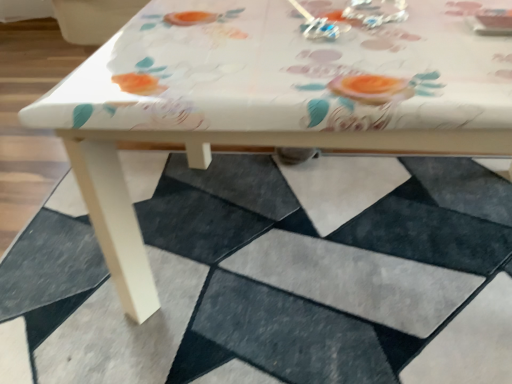
Measure the distance between metallic silver earrings at upper center and camera.

metallic silver earrings at upper center and camera are 66.27 centimeters apart from each other.

Where is `metallic silver earrings at upper center`? metallic silver earrings at upper center is located at coordinates (316, 25).

This screenshot has height=384, width=512. What do you see at coordinates (316, 25) in the screenshot? I see `metallic silver earrings at upper center` at bounding box center [316, 25].

In order to face white matte rug at lower center, should I rotate leftwards or rightwards?

A 0.996 degree turn to the right will do.

Measure the distance between white matte rug at lower center and camera.

white matte rug at lower center is 27.72 inches away from camera.

Find the location of a particular element. The width and height of the screenshot is (512, 384). white matte rug at lower center is located at coordinates (264, 269).

The height and width of the screenshot is (384, 512). Describe the element at coordinates (264, 269) in the screenshot. I see `white matte rug at lower center` at that location.

What is the approximate width of white matte rug at lower center?

It is 3.66 feet.

The height and width of the screenshot is (384, 512). Identify the location of metallic silver earrings at upper center. (316, 25).

Based on their positions, is metallic silver earrings at upper center located to the left or right of white matte rug at lower center?

metallic silver earrings at upper center is positioned on white matte rug at lower center's right side.

Is metallic silver earrings at upper center in front of or behind white matte rug at lower center in the image?

Visually, metallic silver earrings at upper center is located behind white matte rug at lower center.

Is point (308, 14) more distant than point (509, 237)?

No, it is not.

From the picture: From the image's perspective, is metallic silver earrings at upper center located beneath white matte rug at lower center?

No, from the image's perspective, metallic silver earrings at upper center is not below white matte rug at lower center.

From a real-world perspective, which is physically above, metallic silver earrings at upper center or white matte rug at lower center?

In real-world perspective, metallic silver earrings at upper center is above.

Looking at their sizes, would you say metallic silver earrings at upper center is wider or thinner than white matte rug at lower center?

Clearly, metallic silver earrings at upper center has less width compared to white matte rug at lower center.

Can you confirm if metallic silver earrings at upper center is taller than white matte rug at lower center?

Incorrect, the height of metallic silver earrings at upper center is not larger of that of white matte rug at lower center.

Between metallic silver earrings at upper center and white matte rug at lower center, which one has smaller size?

With smaller size is metallic silver earrings at upper center.

Is metallic silver earrings at upper center not within white matte rug at lower center?

Yes, metallic silver earrings at upper center is outside of white matte rug at lower center.

Is the surface of metallic silver earrings at upper center in direct contact with white matte rug at lower center?

No.

Could you tell me if metallic silver earrings at upper center is facing white matte rug at lower center?

No, metallic silver earrings at upper center does not turn towards white matte rug at lower center.

Looking at this image, how many degrees apart are the facing directions of metallic silver earrings at upper center and white matte rug at lower center?

The facing directions of metallic silver earrings at upper center and white matte rug at lower center are 20 degrees apart.

This screenshot has height=384, width=512. In order to click on tableware above the white matte rug at lower center (from a real-world perspective) in this screenshot , I will do `click(316, 25)`.

Is white matte rug at lower center at the left side of metallic silver earrings at upper center?

Yes, white matte rug at lower center is to the left of metallic silver earrings at upper center.

Is white matte rug at lower center in front of or behind metallic silver earrings at upper center in the image?

Clearly, white matte rug at lower center is in front of metallic silver earrings at upper center.

Considering the positions of point (203, 379) and point (302, 25), is point (203, 379) closer or farther from the camera than point (302, 25)?

Point (203, 379).

From the image's perspective, which one is positioned higher, white matte rug at lower center or metallic silver earrings at upper center?

metallic silver earrings at upper center.

From a real-world perspective, which object rests below the other?

white matte rug at lower center is physically lower.

In terms of width, does white matte rug at lower center look wider or thinner when compared to metallic silver earrings at upper center?

white matte rug at lower center is wider than metallic silver earrings at upper center.

Does white matte rug at lower center have a greater height compared to metallic silver earrings at upper center?

Yes, white matte rug at lower center is taller than metallic silver earrings at upper center.

Between white matte rug at lower center and metallic silver earrings at upper center, which one has smaller size?

Smaller between the two is metallic silver earrings at upper center.

Is white matte rug at lower center positioned beyond the bounds of metallic silver earrings at upper center?

Indeed, white matte rug at lower center is completely outside metallic silver earrings at upper center.

Would you consider white matte rug at lower center to be distant from metallic silver earrings at upper center?

They are positioned close to each other.

Is white matte rug at lower center oriented away from metallic silver earrings at upper center?

No, white matte rug at lower center is not facing the opposite direction of metallic silver earrings at upper center.

Where is `square on the left of the metallic silver earrings at upper center`? The width and height of the screenshot is (512, 384). square on the left of the metallic silver earrings at upper center is located at coordinates (264, 269).

Identify the location of tableware above the white matte rug at lower center (from the image's perspective). This screenshot has height=384, width=512. [x=316, y=25].

Locate an element on the screen. The image size is (512, 384). square below the metallic silver earrings at upper center (from the image's perspective) is located at coordinates (264, 269).